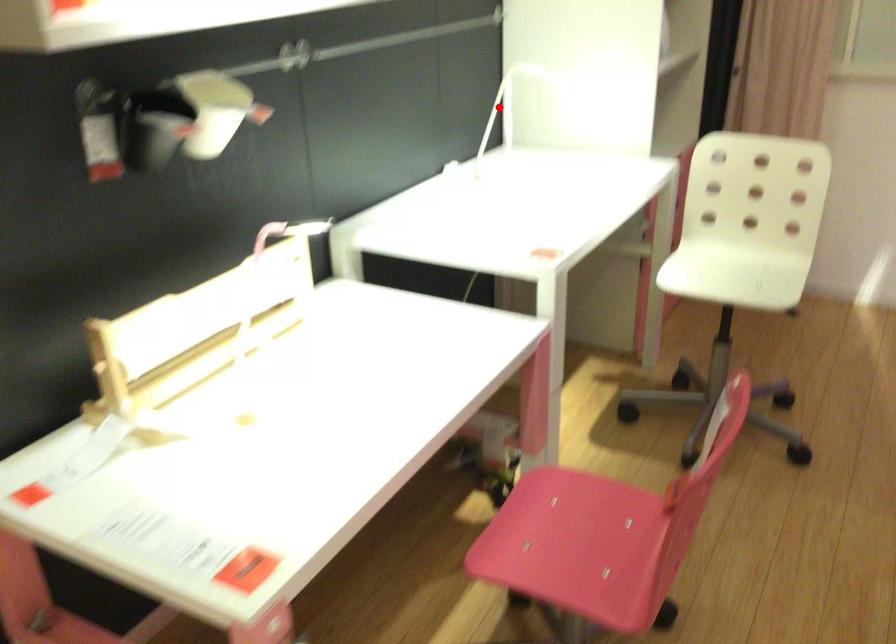
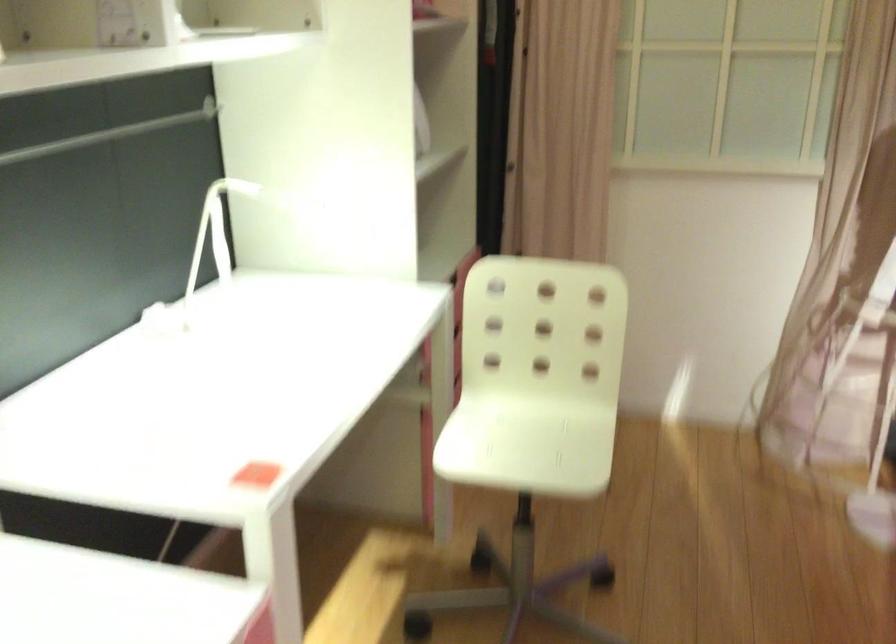
Question: I am providing you with two images of the same scene from different viewpoints. In image1, a red point is highlighted. Considering the same 3D point in image2, which of the following is correct?

Choices:
 (A) It is closer
 (B) It is farther

Answer: (A)